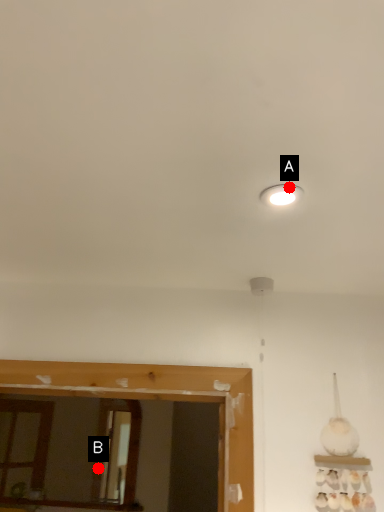
Question: Two points are circled on the image, labeled by A and B beside each circle. Which point is closer to the camera?

Choices:
 (A) A is closer
 (B) B is closer

Answer: (A)